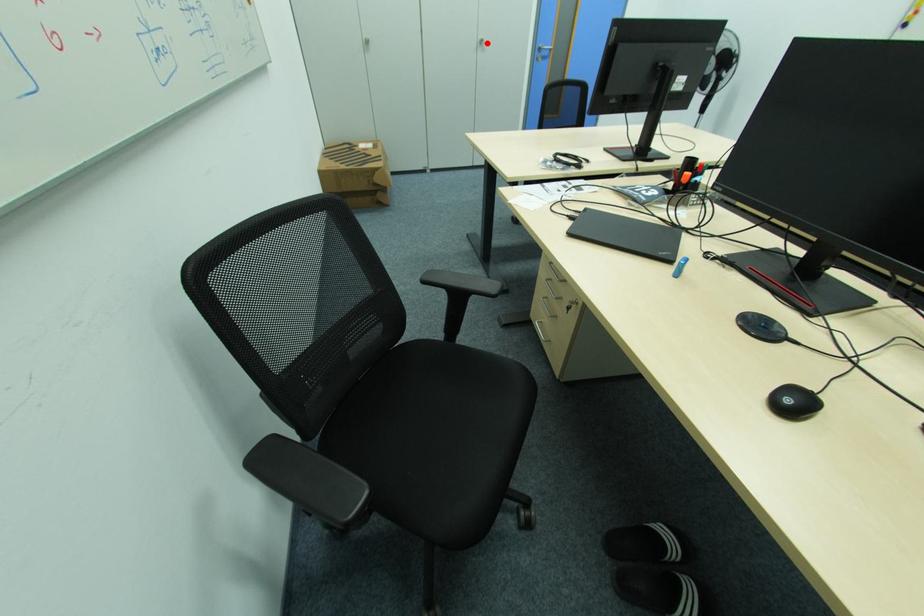
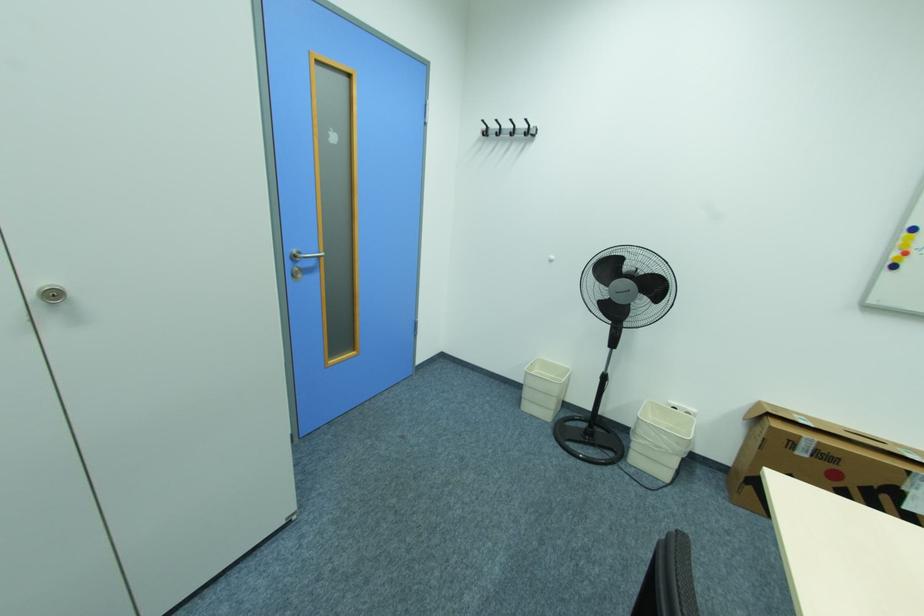
In the second image, find the point that corresponds to the highlighted location in the first image.

(64, 294)